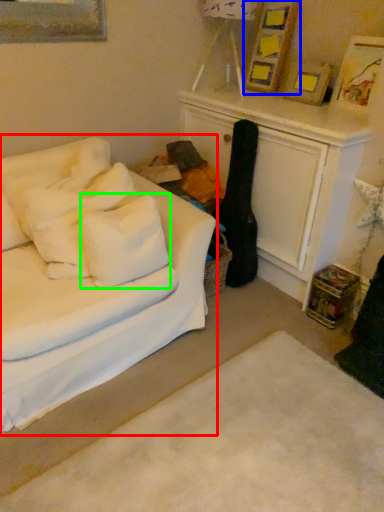
Question: Which object is the farthest from studio couch (highlighted by a red box)? Choose among these: picture frame (highlighted by a blue box) or pillow (highlighted by a green box).

Choices:
 (A) picture frame
 (B) pillow

Answer: (A)